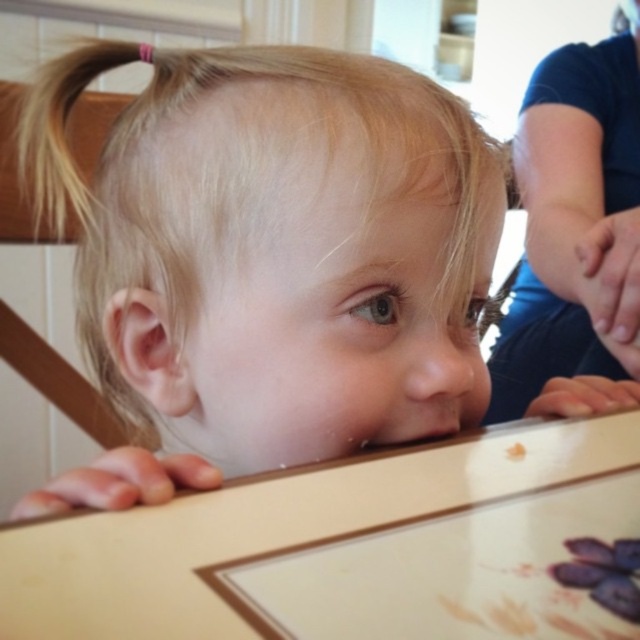
You are a child trying to reach the purple matte grapes at upper center. There are blue denim jeans at upper right in the way. Can you move the jeans to get to the grapes?

The blue denim jeans at upper right is located above the purple matte grapes at upper center, so you can move the jeans downward to access the grapes.

In the scene shown: You are a chef preparing a fruit platter and need to place the purple matte grapes at upper center onto the wooden table at lower center. Given that the grapes have a diameter of 3 centimeters, will they fit on the table without overlapping the edge?

The distance between the wooden table at lower center and purple matte grapes at upper center is 9.02 centimeters. Since the grapes have a diameter of 3 centimeters, they will fit on the table as the distance is greater than the grapes diameter, so there will be enough space.

You are a photographer trying to capture a close shot of the child in the image. You want to ensure that the wooden table edge with floral design is in focus. Given that your camera has a depth of field of 30 inches, will the table edge remain in focus if you focus on the point at coordinates point (611, 298)?

The distance between point (611, 298) and the camera is 29.66 inches. Since the camera has a depth of field of 30 inches, the table edge will remain in focus as it falls within the depth of field range.